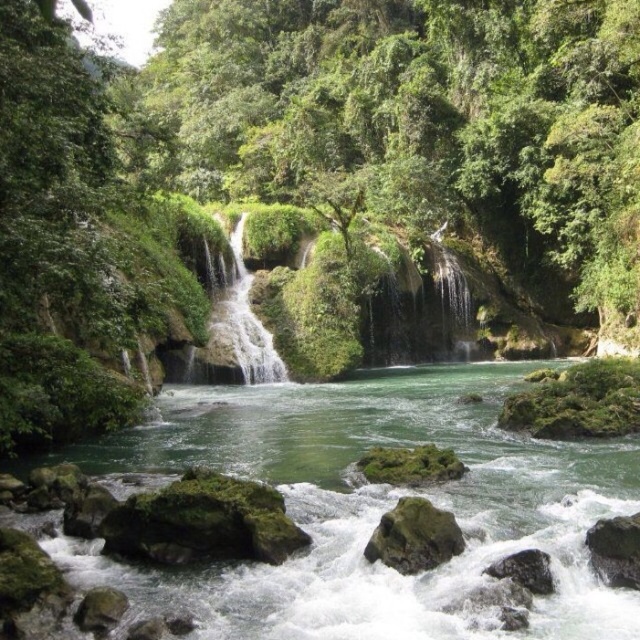
You are standing at the base of the waterfall and want to take a photo. There are two points marked in the scene, point A at coordinates point (381, 547) and point B at coordinates point (113, 588). Which point is closer to your camera lens?

Point B at coordinates point (113, 588) is closer to the camera lens because it is less further away than point A at coordinates point (381, 547) according to their positions.